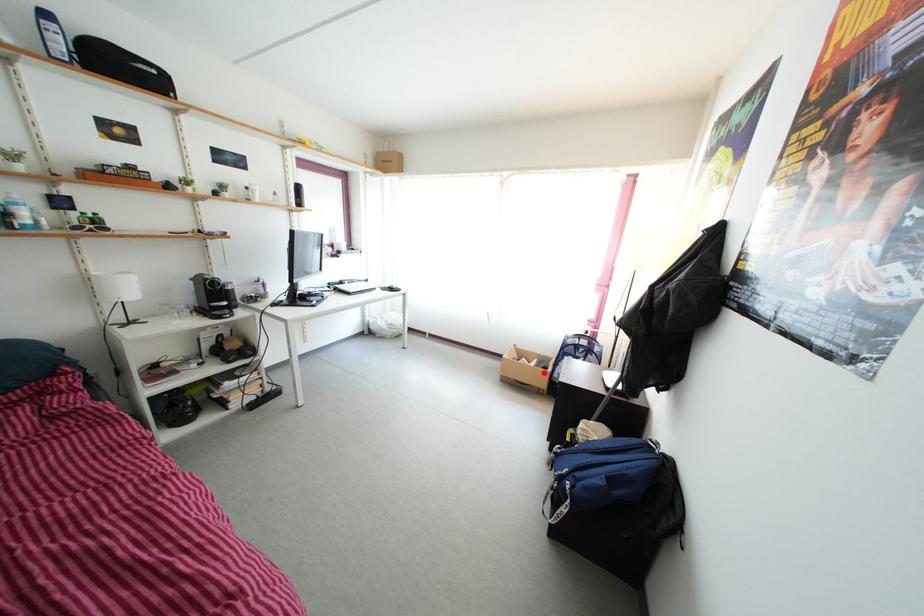
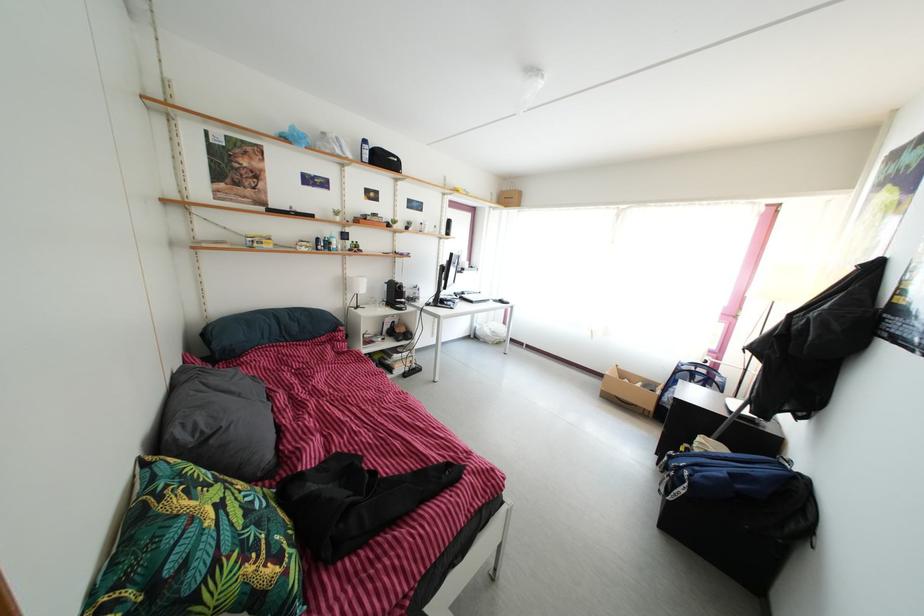
Question: A red point is marked in image1. In image2, is the corresponding 3D point closer to the camera or farther? Reply with the corresponding letter.

Choices:
 (A) The corresponding 3D point is closer.
 (B) The corresponding 3D point is farther.

Answer: (A)